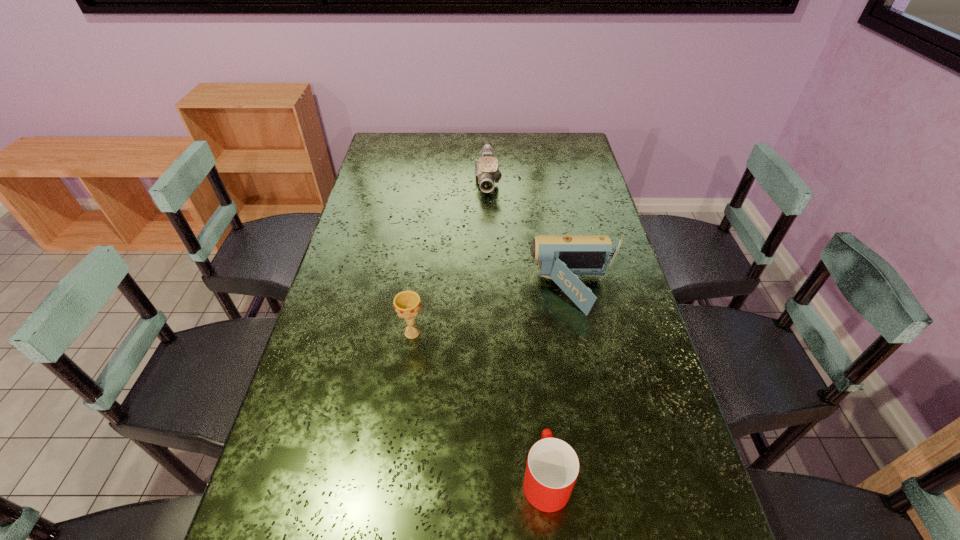
Find the location of a particular element. The height and width of the screenshot is (540, 960). free space between the cup and the leftmost object is located at coordinates (479, 406).

Locate an element on the screen. The height and width of the screenshot is (540, 960). vacant area that lies between the nearest object and the second object from left to right is located at coordinates (516, 329).

The width and height of the screenshot is (960, 540). I want to click on vacant point located between the nearest object and the nearer camcorder, so click(x=560, y=384).

I want to click on vacant space that's between the leftmost object and the third nearest object, so click(x=493, y=312).

This screenshot has width=960, height=540. Identify the location of free space between the chalice and the third nearest object. (493, 312).

This screenshot has height=540, width=960. I want to click on unoccupied position between the left camcorder and the nearest object, so click(516, 329).

The height and width of the screenshot is (540, 960). Find the location of `vacant area that lies between the cup and the nearer camcorder`. vacant area that lies between the cup and the nearer camcorder is located at coordinates (560, 384).

This screenshot has height=540, width=960. I want to click on blank region between the third object from right to left and the leftmost object, so click(450, 256).

Where is `free space that is in between the nearer camcorder and the farthest object`? The width and height of the screenshot is (960, 540). free space that is in between the nearer camcorder and the farthest object is located at coordinates (531, 236).

The width and height of the screenshot is (960, 540). Identify the location of free space between the third nearest object and the chalice. (493, 312).